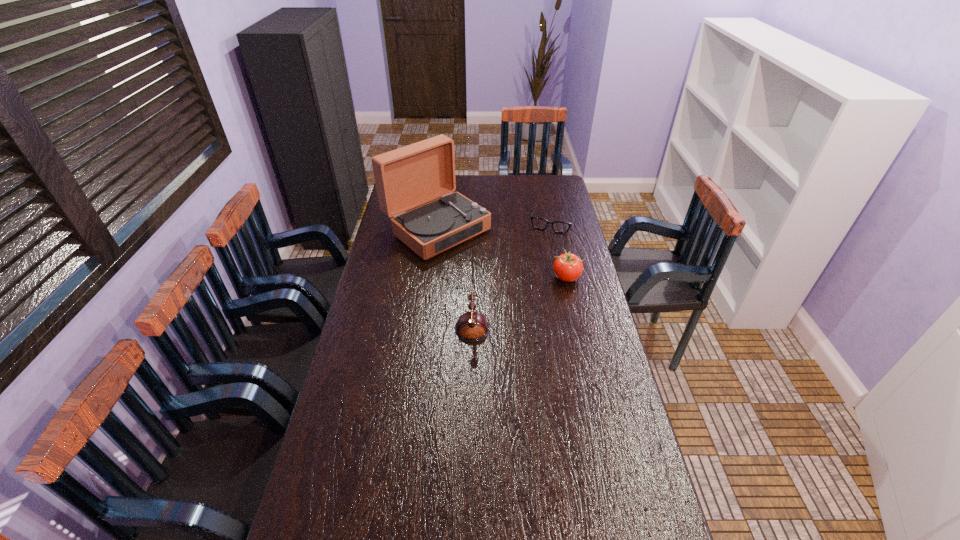
You are a GUI agent. You are given a task and a screenshot of the screen. Output one action in this format:
    pyautogui.click(x=<x>, y=<y>)
    Task: Click on the vacant space on the desktop that is between the telephone and the tomato and is positioned on the front-facing side of the spectacles
    This screenshot has width=960, height=540.
    Given the screenshot: What is the action you would take?
    pyautogui.click(x=528, y=292)

This screenshot has height=540, width=960. Identify the location of free spot on the desktop that is between the telephone and the tomato and is positioned on the face of the phonograph record. (523, 293).